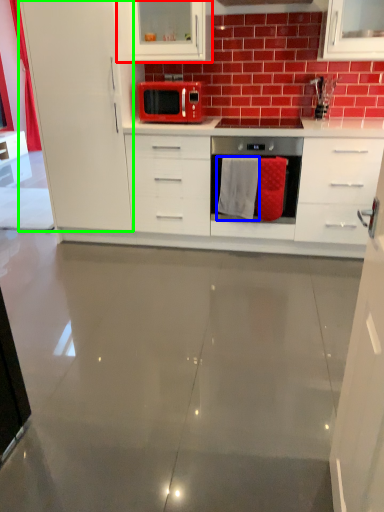
Question: Which object is the farthest from cabinetry (highlighted by a red box)? Choose among these: material (highlighted by a blue box) or cabinetry (highlighted by a green box).

Choices:
 (A) material
 (B) cabinetry

Answer: (A)